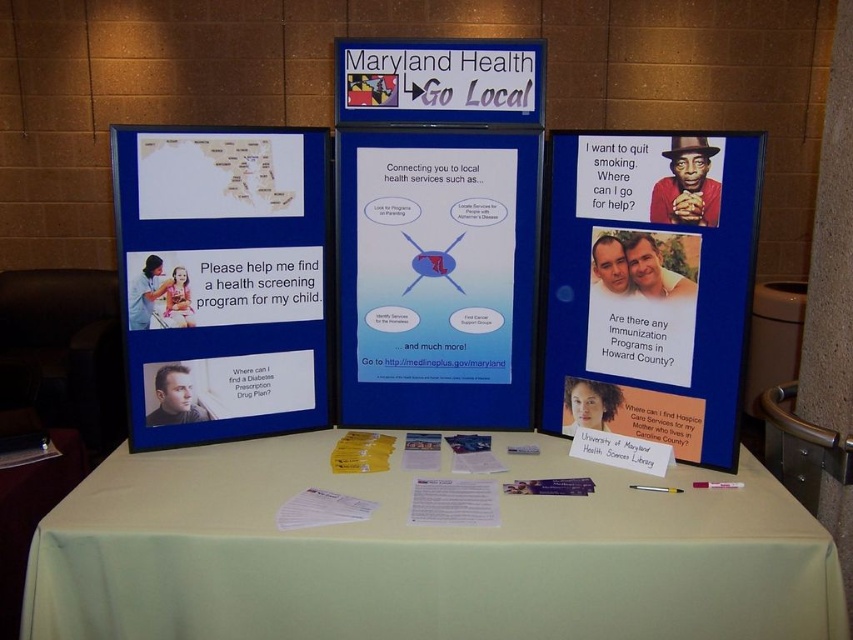
Find the location of a particular element. Image resolution: width=853 pixels, height=640 pixels. matte paper poster at right is located at coordinates (650, 285).

Is matte paper poster at right behind matte blue poster at center?

No, it is in front of matte blue poster at center.

Which is in front, point (650, 228) or point (457, 228)?

Point (650, 228)

Where is `matte paper poster at right`? matte paper poster at right is located at coordinates (650, 285).

Is point (724, 566) positioned after point (642, 244)?

No, (724, 566) is in front of (642, 244).

Who is more distant from viewer, (584, 634) or (662, 310)?

The point (662, 310) is behind.

The image size is (853, 640). Find the location of `green fabric tablecloth at center`. green fabric tablecloth at center is located at coordinates (424, 554).

Which is below, blue matte poster at left or matte paper poster at right?

matte paper poster at right is below.

Which is more to the right, blue matte poster at left or matte paper poster at right?

matte paper poster at right is more to the right.

Is point (270, 154) in front of point (727, 342)?

That is False.

This screenshot has width=853, height=640. Identify the location of blue matte poster at left. (222, 280).